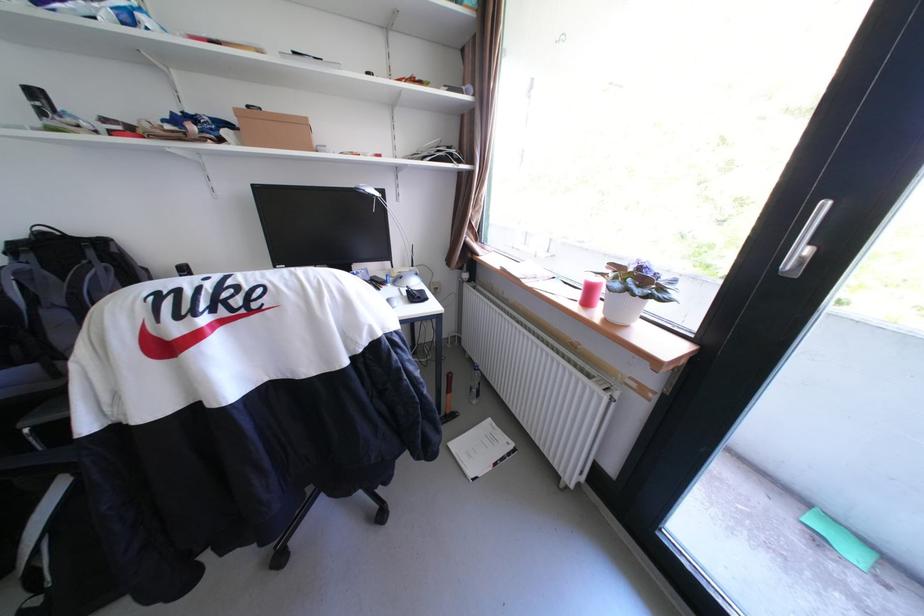
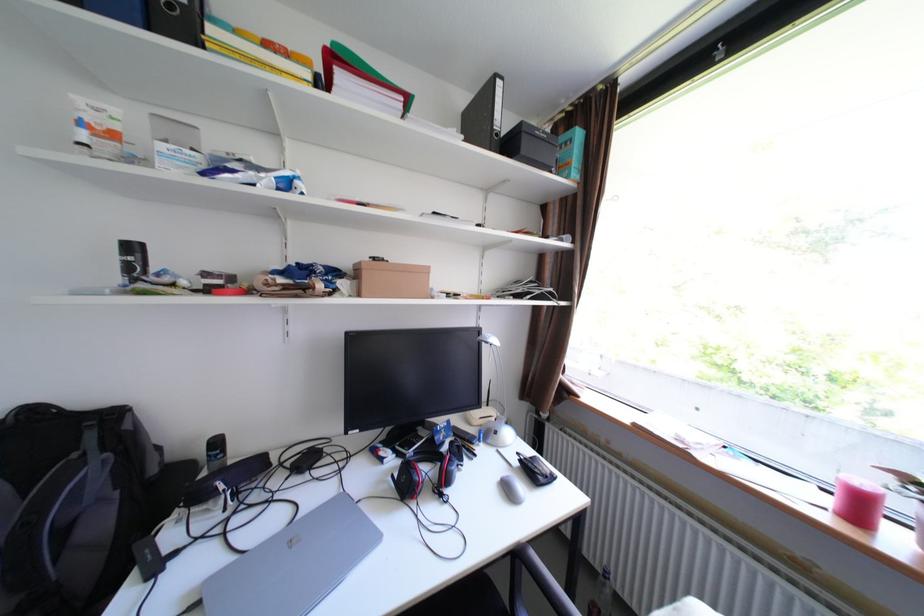
Question: The first image is from the beginning of the video and the second image is from the end. How did the camera likely rotate when shooting the video?

Choices:
 (A) Left
 (B) Right
 (C) Up
 (D) Down

Answer: (C)